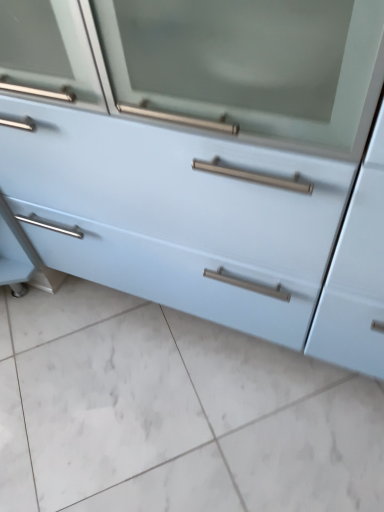
Question: Is white glossy tile at lower center not close to light blue matte cabinet at center?

Choices:
 (A) no
 (B) yes

Answer: (A)

Question: Can you confirm if white glossy tile at lower center is positioned to the right of light blue matte cabinet at center?

Choices:
 (A) yes
 (B) no

Answer: (B)

Question: From a real-world perspective, is white glossy tile at lower center located higher than light blue matte cabinet at center?

Choices:
 (A) no
 (B) yes

Answer: (A)

Question: From the image's perspective, would you say white glossy tile at lower center is shown under light blue matte cabinet at center?

Choices:
 (A) no
 (B) yes

Answer: (B)

Question: Is white glossy tile at lower center taller than light blue matte cabinet at center?

Choices:
 (A) no
 (B) yes

Answer: (A)

Question: From the image's perspective, does white glossy tile at lower center appear higher than light blue matte cabinet at center?

Choices:
 (A) yes
 (B) no

Answer: (B)

Question: From the image's perspective, is light blue matte cabinet at center on top of white glossy tile at lower center?

Choices:
 (A) no
 (B) yes

Answer: (B)

Question: Is light blue matte cabinet at center not near white glossy tile at lower center?

Choices:
 (A) yes
 (B) no

Answer: (B)

Question: Could you tell me if light blue matte cabinet at center is facing white glossy tile at lower center?

Choices:
 (A) no
 (B) yes

Answer: (B)

Question: Is light blue matte cabinet at center behind white glossy tile at lower center?

Choices:
 (A) yes
 (B) no

Answer: (B)

Question: Considering the relative sizes of light blue matte cabinet at center and white glossy tile at lower center in the image provided, is light blue matte cabinet at center wider than white glossy tile at lower center?

Choices:
 (A) no
 (B) yes

Answer: (A)

Question: Is white glossy tile at lower center a part of light blue matte cabinet at center?

Choices:
 (A) yes
 (B) no

Answer: (B)

Question: Considering the positions of light blue matte cabinet at center and white glossy tile at lower center in the image, is light blue matte cabinet at center taller or shorter than white glossy tile at lower center?

Choices:
 (A) tall
 (B) short

Answer: (A)